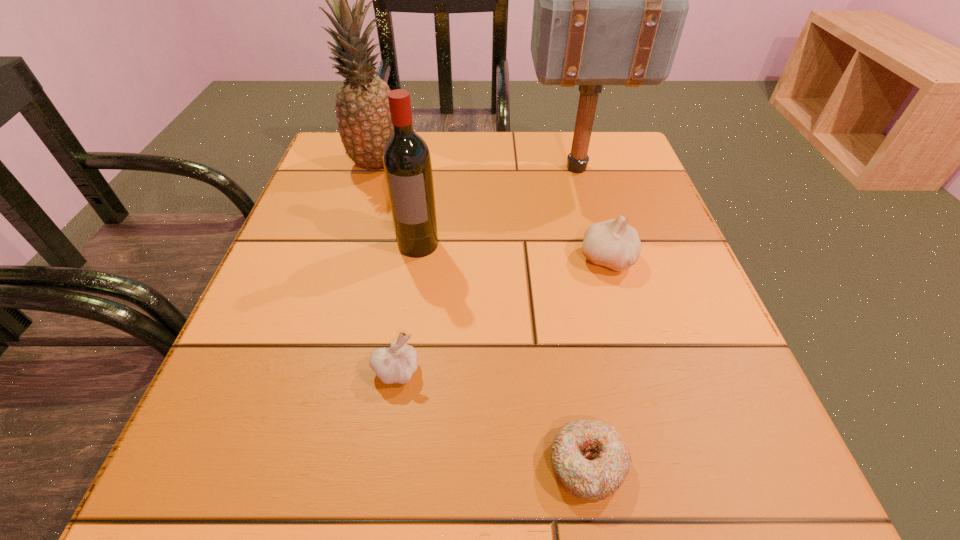
This screenshot has height=540, width=960. Identify the location of vacant space situated 0.170m on the striking surface of the mallet. (x=452, y=168).

Where is `vacant space situated 0.340m on the striking surface of the mallet`? The image size is (960, 540). vacant space situated 0.340m on the striking surface of the mallet is located at coordinates (380, 168).

You are a GUI agent. You are given a task and a screenshot of the screen. Output one action in this format:
    pyautogui.click(x=<x>, y=<y>)
    Task: Click on the free space located 0.070m on the left of the pineapple
    The image size is (960, 540).
    Given the screenshot: What is the action you would take?
    pyautogui.click(x=319, y=164)

Identify the location of free space located on the label of the fourth shortest object. This screenshot has height=540, width=960. (392, 426).

Image resolution: width=960 pixels, height=540 pixels. I want to click on free space located on the left of the third shortest object, so click(x=467, y=259).

The height and width of the screenshot is (540, 960). I want to click on free region located on the back of the second shortest object, so click(x=409, y=285).

Where is `blank area located 0.120m on the left of the shortest object`? Image resolution: width=960 pixels, height=540 pixels. blank area located 0.120m on the left of the shortest object is located at coordinates (453, 464).

Where is `mallet that is positioned at the far edge`? Image resolution: width=960 pixels, height=540 pixels. mallet that is positioned at the far edge is located at coordinates (610, 0).

Locate an element on the screen. The width and height of the screenshot is (960, 540). pineapple located in the far edge section of the desktop is located at coordinates (363, 115).

This screenshot has height=540, width=960. What are the coordinates of `object that is positioned at the near edge` in the screenshot? It's located at (590, 459).